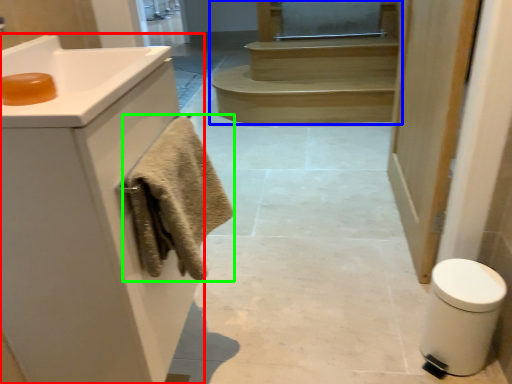
Question: Considering the real-world distances, which object is farthest from bathroom cabinet (highlighted by a red box)? stairs (highlighted by a blue box) or bath towel (highlighted by a green box)?

Choices:
 (A) stairs
 (B) bath towel

Answer: (A)